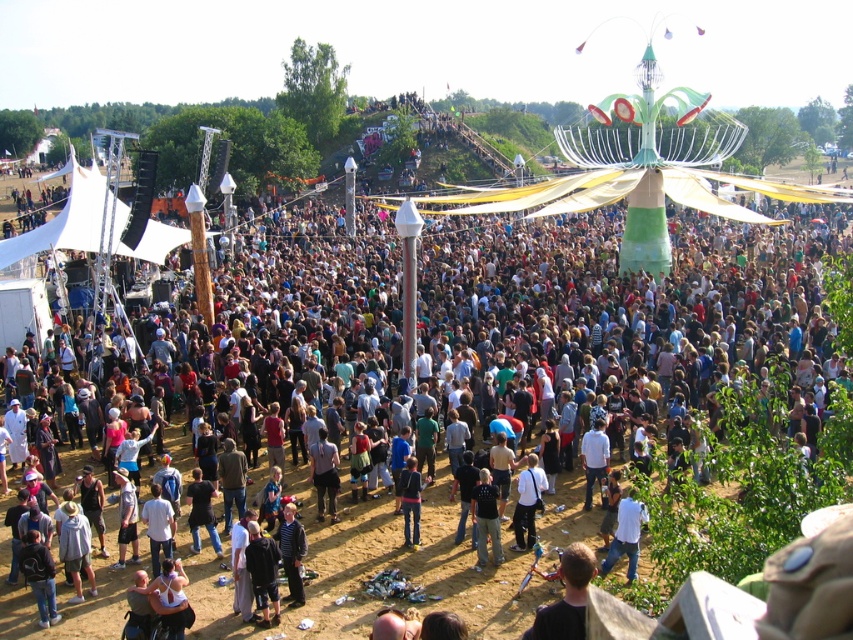
Describe the element at coordinates (486, 518) in the screenshot. I see `black matte shirt at center` at that location.

Who is lower down, black matte shirt at center or white matte shirt at center?

Positioned lower is black matte shirt at center.

Is point (489, 522) less distant than point (529, 483)?

Yes, it is in front of point (529, 483).

You are a GUI agent. You are given a task and a screenshot of the screen. Output one action in this format:
    pyautogui.click(x=<x>, y=<y>)
    Task: Click on the black matte shirt at center
    The image size is (853, 640).
    Given the screenshot: What is the action you would take?
    pyautogui.click(x=486, y=518)

Which is more to the left, white matte shirt at center or dark gray fabric pants at lower center?

dark gray fabric pants at lower center is more to the left.

The height and width of the screenshot is (640, 853). Describe the element at coordinates (527, 502) in the screenshot. I see `white matte shirt at center` at that location.

Identify the location of white matte shirt at center. (527, 502).

Can you confirm if black matte shirt at center is taller than dark gray fabric pants at lower center?

Yes, black matte shirt at center is taller than dark gray fabric pants at lower center.

Which is below, black matte shirt at center or dark gray fabric pants at lower center?

black matte shirt at center is lower down.

Is point (473, 513) in front of point (328, 493)?

Yes, it is.

Locate an element on the screen. black matte shirt at center is located at coordinates pyautogui.click(x=486, y=518).